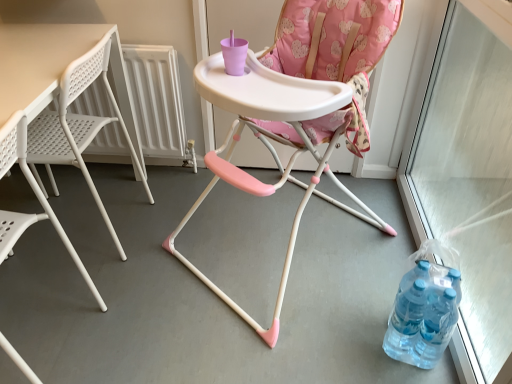
The width and height of the screenshot is (512, 384). Find the location of `vacant space that is in between pink plastic highchair at center, positioned as the 1th chair in right-to-left order, and white plastic chair at left, which appears as the first chair when viewed from the left`. vacant space that is in between pink plastic highchair at center, positioned as the 1th chair in right-to-left order, and white plastic chair at left, which appears as the first chair when viewed from the left is located at coordinates coord(155,305).